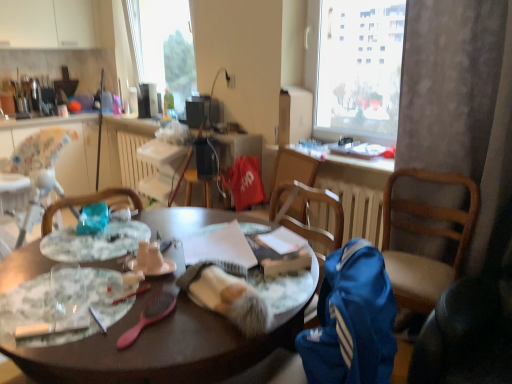
Identify the location of empty space that is ontop of wooden table at center (from a real-world perspective). The height and width of the screenshot is (384, 512). (144, 287).